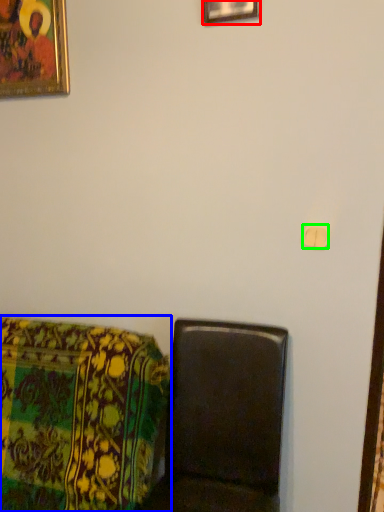
Question: Considering the real-world distances, which object is closest to picture frame (highlighted by a red box)? furniture (highlighted by a blue box) or light switch (highlighted by a green box).

Choices:
 (A) furniture
 (B) light switch

Answer: (B)